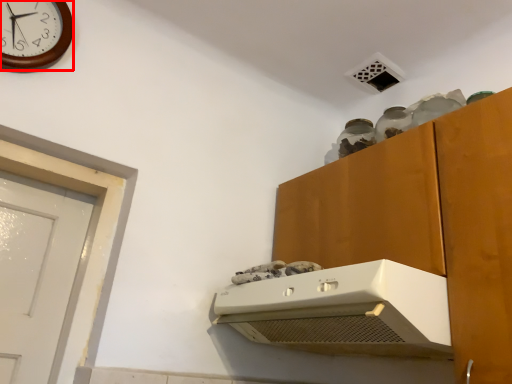
Question: From the image's perspective, what is the correct spatial positioning of wall clock (annotated by the red box) in reference to home appliance?

Choices:
 (A) above
 (B) below

Answer: (A)